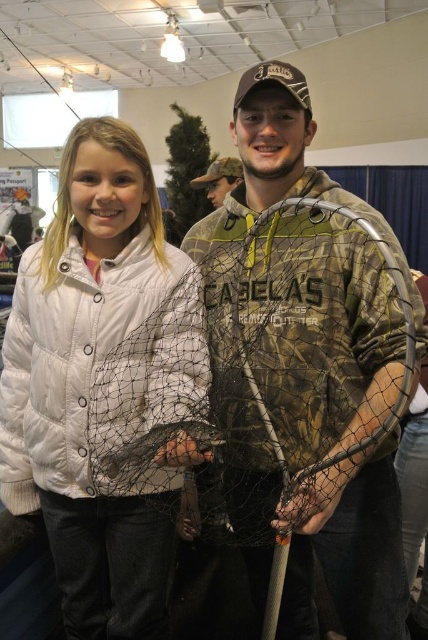
Question: Where is camo fabric fishing net at center located in relation to white puffy jacket at center in the image?

Choices:
 (A) above
 (B) below

Answer: (A)

Question: Which of these objects is positioned farthest from the white puffy jacket at center?

Choices:
 (A) translucent netting at center
 (B) camouflage fabric hat at upper center

Answer: (B)

Question: Does translucent netting at center appear over camouflage fabric hat at upper center?

Choices:
 (A) yes
 (B) no

Answer: (B)

Question: Does camo fabric fishing net at center appear over translucent netting at center?

Choices:
 (A) no
 (B) yes

Answer: (B)

Question: Which point is farther to the camera?

Choices:
 (A) camo fabric fishing net at center
 (B) camouflage fabric hat at upper center
 (C) translucent netting at center

Answer: (B)

Question: Which object appears closest to the camera in this image?

Choices:
 (A) camouflage fabric hat at upper center
 (B) camo fabric fishing net at center
 (C) white puffy jacket at center

Answer: (B)